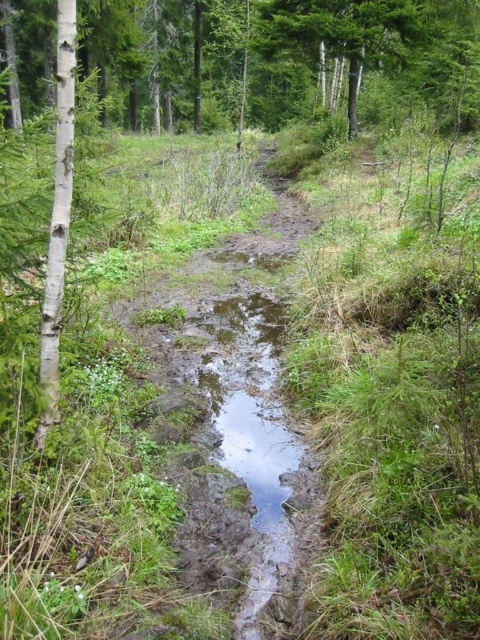
Question: Among these objects, which one is farthest from the camera?

Choices:
 (A) green matte tree at upper center
 (B) white smooth tree at left

Answer: (A)

Question: Does green matte tree at upper center appear on the right side of white smooth tree at left?

Choices:
 (A) no
 (B) yes

Answer: (A)

Question: Is green matte tree at upper center positioned in front of white smooth tree at left?

Choices:
 (A) no
 (B) yes

Answer: (A)

Question: Which point is farther to the camera?

Choices:
 (A) white smooth tree at left
 (B) green matte tree at upper center

Answer: (B)

Question: Does green matte tree at upper center have a greater width compared to white smooth tree at left?

Choices:
 (A) yes
 (B) no

Answer: (A)